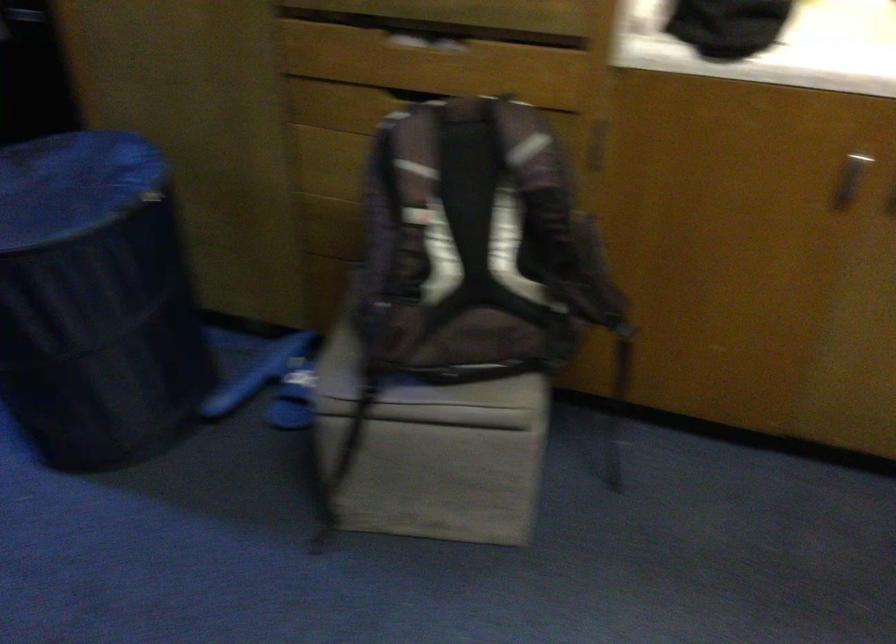
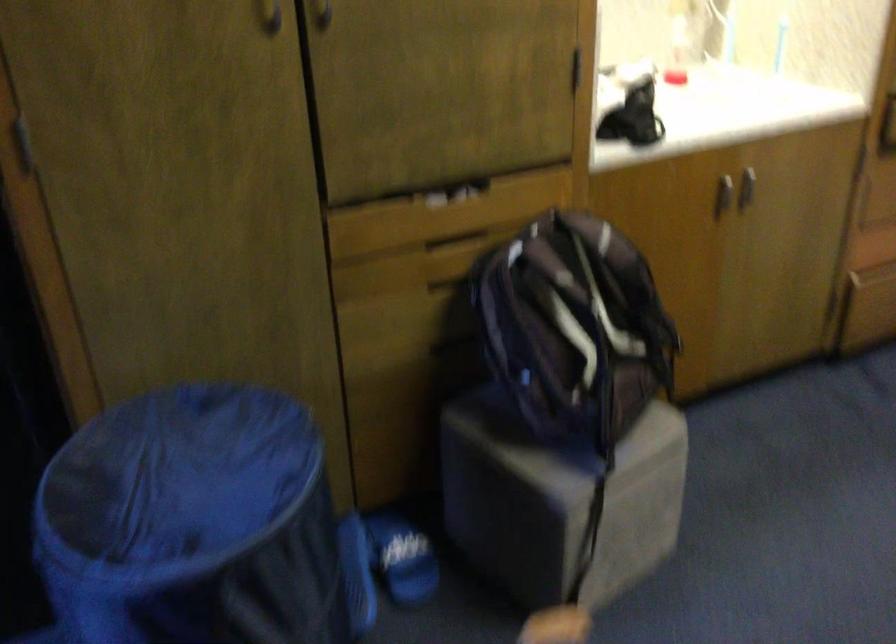
Where in the second image is the point corresponding to the point at 298,386 from the first image?

(401, 558)